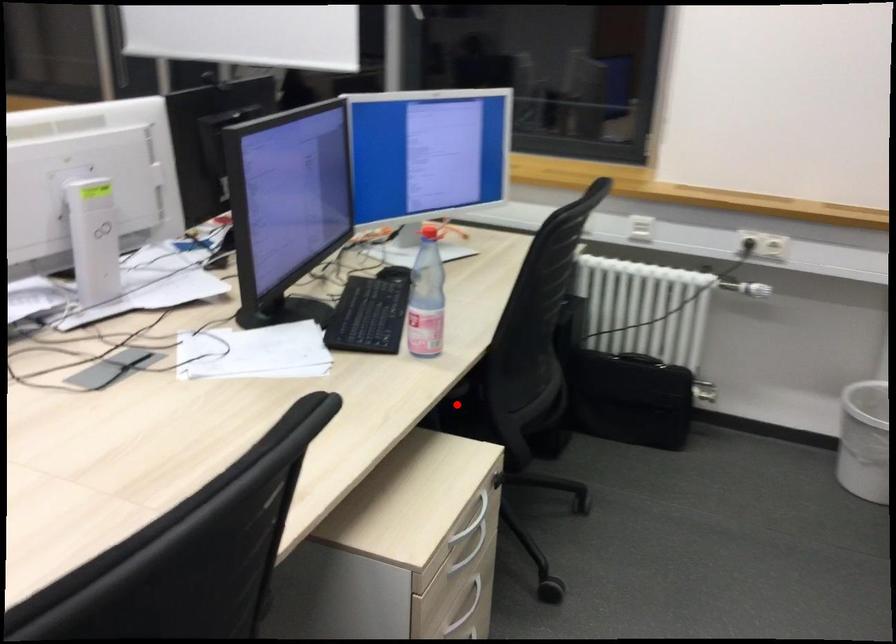
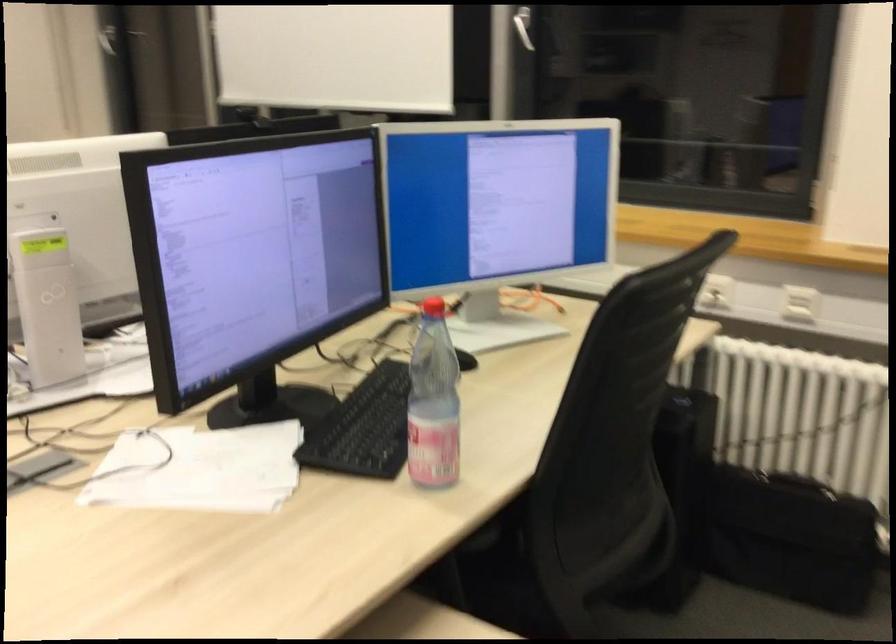
The point at the highlighted location is marked in the first image. Where is the corresponding point in the second image?

(503, 545)